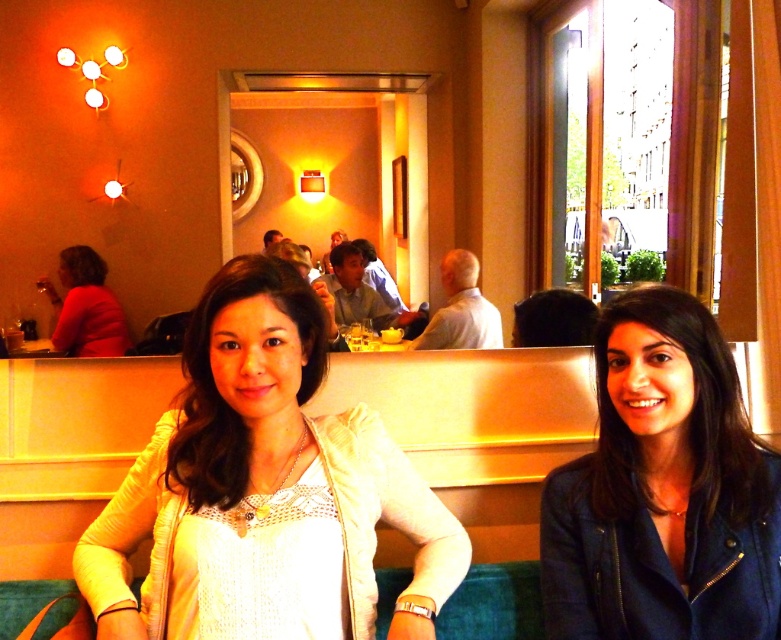
Question: Which of these objects is positioned farthest from the dark blue leather jacket at lower right?

Choices:
 (A) white lace top at center
 (B) matte red shirt at left

Answer: (B)

Question: Is white lace top at center closer to camera compared to matte red shirt at left?

Choices:
 (A) no
 (B) yes

Answer: (B)

Question: Which object is positioned farthest from the dark blue leather jacket at lower right?

Choices:
 (A) matte red shirt at left
 (B) white lace top at center

Answer: (A)

Question: Is white lace top at center bigger than dark blue leather jacket at lower right?

Choices:
 (A) no
 (B) yes

Answer: (B)

Question: Considering the real-world distances, which object is farthest from the white lace top at center?

Choices:
 (A) matte red shirt at left
 (B) dark blue leather jacket at lower right

Answer: (A)

Question: Is dark blue leather jacket at lower right thinner than matte red shirt at left?

Choices:
 (A) yes
 (B) no

Answer: (A)